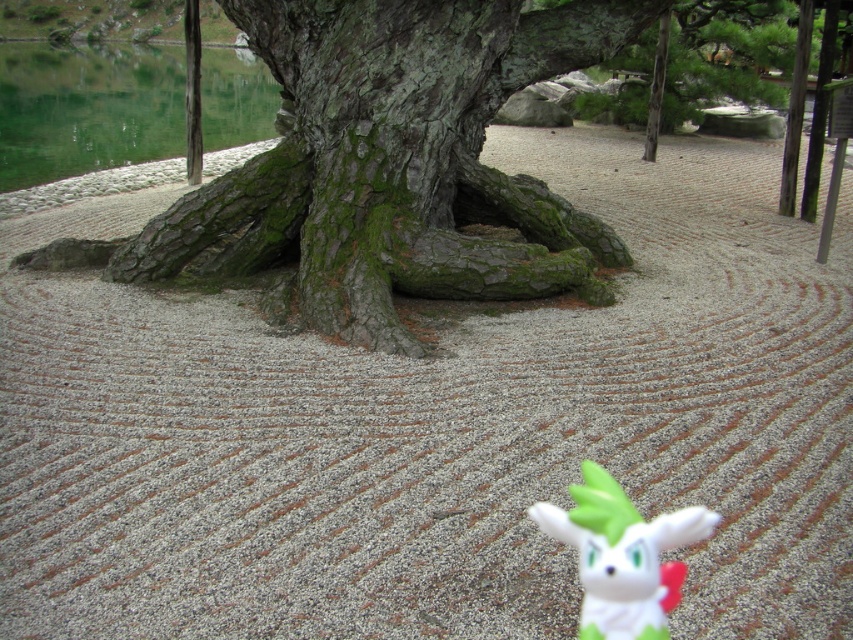
You are a visitor in the garden and want to pick up the white matte plush toy at lower center. To reach it, you need to walk around the green mossy bark tree at center. Which direction should you go to find the shortest path around the tree to the toy?

The white matte plush toy at lower center is behind the green mossy bark tree at center, so you should walk around the tree in the direction that allows you to go behind it to reach the toy quickly.

Based on the photo, you are standing in the Japanese garden and want to reach the gravel path near the tree. You see two points marked in the scene. Which point is closer to you, point (363, 172) or point (643, 554)?

Point (363, 172) is closer to you because it is further to the camera than point (643, 554).

You are a visitor in the garden and want to place a new decorative stone between the green mossy bark tree at center and the white matte plush toy at lower center. Based on their positions, which object should the stone be closer to?

The stone should be placed closer to the white matte plush toy at lower center because the green mossy bark tree at center is positioned on the left side of the white matte plush toy at lower center, meaning the plush toy is to the right of the tree. Therefore, placing the stone closer to the plush toy would maintain the spatial relationship between the two objects.